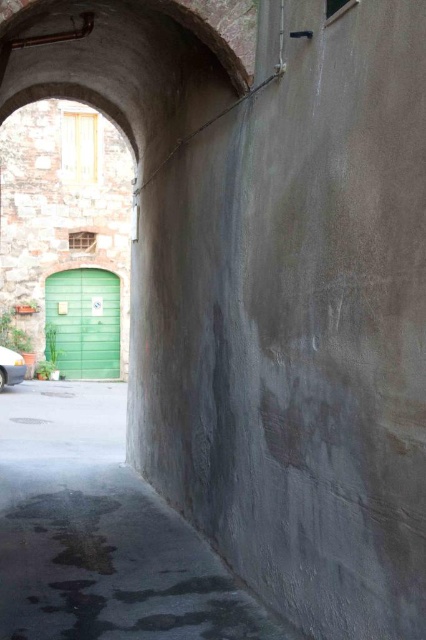
Question: Does green wooden door at left have a greater width compared to white glossy car at lower left?

Choices:
 (A) no
 (B) yes

Answer: (B)

Question: Is green wooden door at left closer to camera compared to white glossy car at lower left?

Choices:
 (A) yes
 (B) no

Answer: (B)

Question: Which point is closer to the camera?

Choices:
 (A) green wooden door at left
 (B) white glossy car at lower left

Answer: (B)

Question: Which of the following is the closest to the observer?

Choices:
 (A) (77, 371)
 (B) (14, 378)

Answer: (B)

Question: Does green wooden door at left have a smaller size compared to white glossy car at lower left?

Choices:
 (A) no
 (B) yes

Answer: (A)